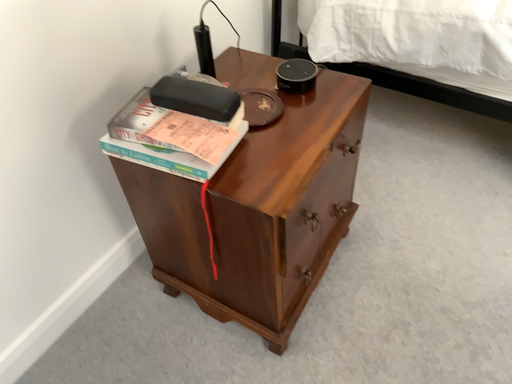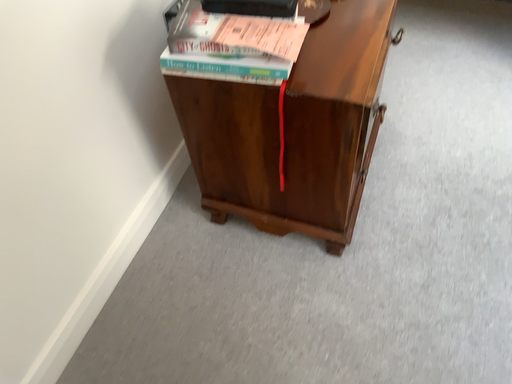
Question: How did the camera likely rotate when shooting the video?

Choices:
 (A) rotated upward
 (B) rotated downward

Answer: (B)